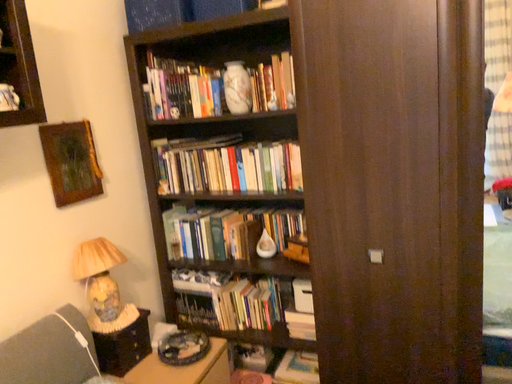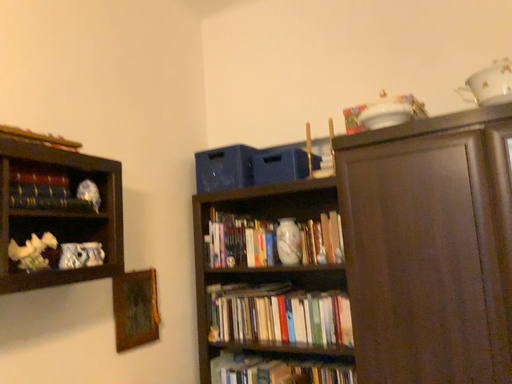
Question: How did the camera likely rotate when shooting the video?

Choices:
 (A) rotated downward
 (B) rotated upward

Answer: (B)